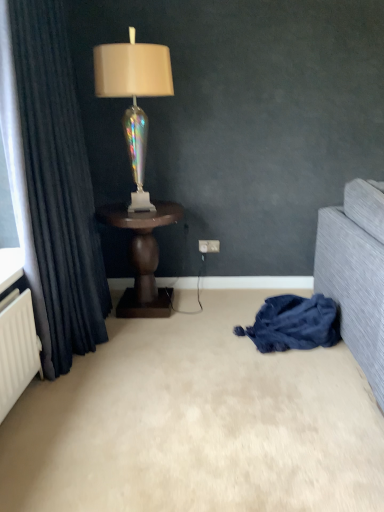
Question: Considering the relative sizes of dark wood side table at center and iridescent glass lamp at center in the image provided, is dark wood side table at center thinner than iridescent glass lamp at center?

Choices:
 (A) yes
 (B) no

Answer: (B)

Question: From a real-world perspective, is dark wood side table at center under iridescent glass lamp at center?

Choices:
 (A) no
 (B) yes

Answer: (B)

Question: Considering the relative sizes of dark wood side table at center and iridescent glass lamp at center in the image provided, is dark wood side table at center wider than iridescent glass lamp at center?

Choices:
 (A) yes
 (B) no

Answer: (A)

Question: Is the position of dark wood side table at center more distant than that of iridescent glass lamp at center?

Choices:
 (A) no
 (B) yes

Answer: (B)

Question: Would you say dark wood side table at center is outside iridescent glass lamp at center?

Choices:
 (A) yes
 (B) no

Answer: (A)

Question: Considering the relative sizes of dark wood side table at center and iridescent glass lamp at center in the image provided, is dark wood side table at center shorter than iridescent glass lamp at center?

Choices:
 (A) no
 (B) yes

Answer: (B)

Question: Does white plastic electric outlet at center have a greater height compared to dark blue textured curtain at left?

Choices:
 (A) yes
 (B) no

Answer: (B)

Question: Could you tell me if white plastic electric outlet at center is facing dark blue textured curtain at left?

Choices:
 (A) yes
 (B) no

Answer: (B)

Question: Is white plastic electric outlet at center further to camera compared to dark blue textured curtain at left?

Choices:
 (A) no
 (B) yes

Answer: (B)

Question: Is white plastic electric outlet at center not inside dark blue textured curtain at left?

Choices:
 (A) yes
 (B) no

Answer: (A)

Question: Is white plastic electric outlet at center touching dark blue textured curtain at left?

Choices:
 (A) no
 (B) yes

Answer: (A)

Question: Considering the relative sizes of white plastic electric outlet at center and dark blue textured curtain at left in the image provided, is white plastic electric outlet at center shorter than dark blue textured curtain at left?

Choices:
 (A) no
 (B) yes

Answer: (B)

Question: Considering the relative sizes of iridescent glass lamp at center and white plastic electric outlet at center in the image provided, is iridescent glass lamp at center bigger than white plastic electric outlet at center?

Choices:
 (A) no
 (B) yes

Answer: (B)